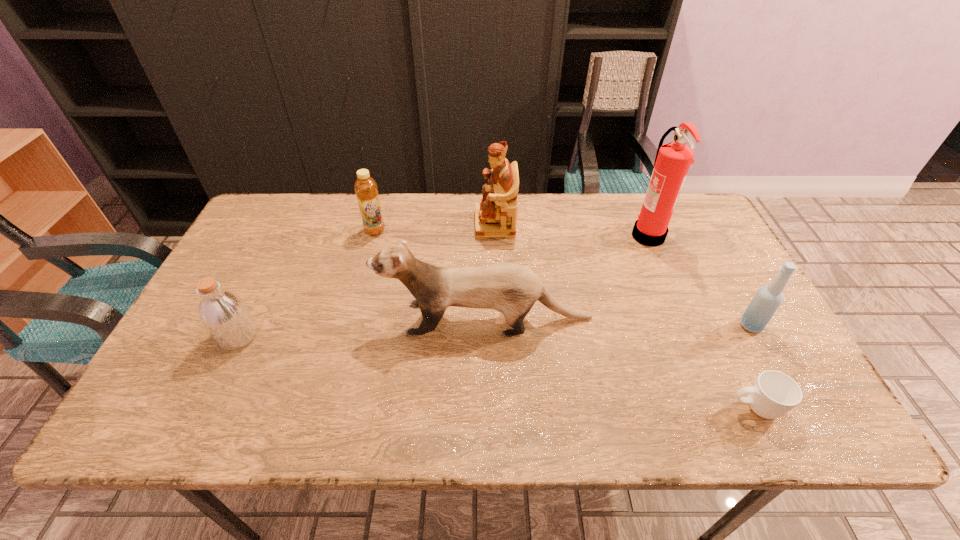
Locate an element on the screen. This screenshot has width=960, height=540. vacant space located on the right of the leftmost object is located at coordinates (295, 336).

Where is `vacant space located 0.370m with the handle on the side of the shortest object`? vacant space located 0.370m with the handle on the side of the shortest object is located at coordinates (555, 408).

At what (x,y) coordinates should I click in order to perform the action: click on blank space located 0.280m with the handle on the side of the shortest object. Please return your answer as a coordinate pair (x, y). Looking at the image, I should click on (596, 408).

Image resolution: width=960 pixels, height=540 pixels. I want to click on vacant area situated 0.080m with the handle on the side of the shortest object, so click(x=690, y=408).

Where is `fire extinguisher that is at the far edge`? fire extinguisher that is at the far edge is located at coordinates (673, 160).

Where is `figurine present at the far edge`? This screenshot has width=960, height=540. figurine present at the far edge is located at coordinates (496, 214).

Identify the location of bottle at the far edge. This screenshot has height=540, width=960. (365, 187).

You are a GUI agent. You are given a task and a screenshot of the screen. Output one action in this format:
    pyautogui.click(x=<x>, y=<y>)
    Task: Click on the object present at the near edge
    This screenshot has height=540, width=960.
    Given the screenshot: What is the action you would take?
    pyautogui.click(x=773, y=394)

The image size is (960, 540). I want to click on object present at the left edge, so click(x=223, y=314).

Find the location of a particular element. fire extinguisher located in the right edge section of the desktop is located at coordinates (673, 160).